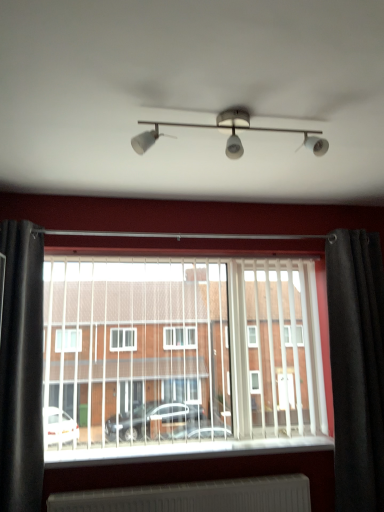
Question: In terms of height, does black fabric curtain at left, the first curtain viewed from the left, look taller or shorter compared to black velvet curtain at right, which ranks as the second curtain in left-to-right order?

Choices:
 (A) short
 (B) tall

Answer: (A)

Question: Is black fabric curtain at left, the first curtain viewed from the left, spatially inside black velvet curtain at right, which ranks as the second curtain in left-to-right order, or outside of it?

Choices:
 (A) outside
 (B) inside

Answer: (A)

Question: Considering the real-world distances, which object is farthest from the satin white track lights at center?

Choices:
 (A) white plastic blinds at center
 (B) white plastic window sill at center
 (C) black velvet curtain at right, which ranks as the second curtain in left-to-right order
 (D) black fabric curtain at left, the second curtain positioned from the right

Answer: (B)

Question: Which object is positioned farthest from the satin white track lights at center?

Choices:
 (A) black velvet curtain at right, which ranks as the second curtain in left-to-right order
 (B) white plastic blinds at center
 (C) white plastic window sill at center
 (D) black fabric curtain at left, the second curtain positioned from the right

Answer: (C)